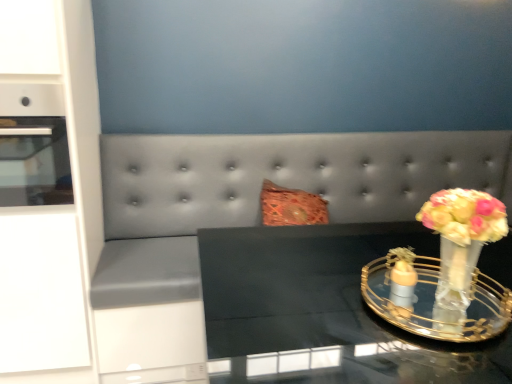
Question: Is translucent glass vase at right next to black glass table at center?

Choices:
 (A) yes
 (B) no

Answer: (B)

Question: Is translucent glass vase at right taller than black glass table at center?

Choices:
 (A) no
 (B) yes

Answer: (A)

Question: From the image's perspective, is translucent glass vase at right on top of black glass table at center?

Choices:
 (A) yes
 (B) no

Answer: (A)

Question: Is black glass table at center surrounded by translucent glass vase at right?

Choices:
 (A) yes
 (B) no

Answer: (B)

Question: Is translucent glass vase at right further to camera compared to black glass table at center?

Choices:
 (A) yes
 (B) no

Answer: (A)

Question: Is translucent glass vase at right located outside black glass table at center?

Choices:
 (A) no
 (B) yes

Answer: (B)

Question: Are suede gray couch at center and white glossy cabinet at left making contact?

Choices:
 (A) yes
 (B) no

Answer: (B)

Question: Is suede gray couch at center oriented towards white glossy cabinet at left?

Choices:
 (A) no
 (B) yes

Answer: (A)

Question: Is suede gray couch at center taller than white glossy cabinet at left?

Choices:
 (A) yes
 (B) no

Answer: (B)

Question: Can you confirm if suede gray couch at center is smaller than white glossy cabinet at left?

Choices:
 (A) yes
 (B) no

Answer: (B)

Question: From a real-world perspective, is suede gray couch at center physically above white glossy cabinet at left?

Choices:
 (A) yes
 (B) no

Answer: (B)

Question: From a real-world perspective, is suede gray couch at center located beneath white glossy cabinet at left?

Choices:
 (A) no
 (B) yes

Answer: (B)

Question: Is there a large distance between suede gray couch at center and matte orange glass candle holder at right, the 2th candle holder from the right?

Choices:
 (A) yes
 (B) no

Answer: (A)